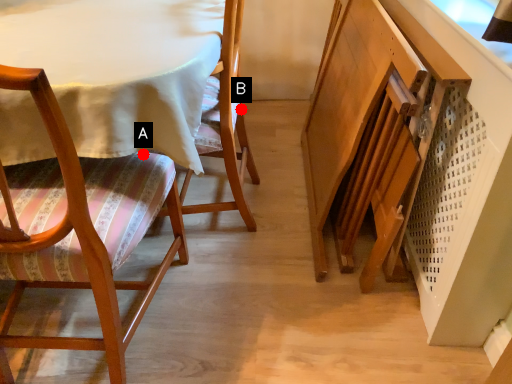
Question: Two points are circled on the image, labeled by A and B beside each circle. Which of the following is the farthest from the observer?

Choices:
 (A) A is further
 (B) B is further

Answer: (B)